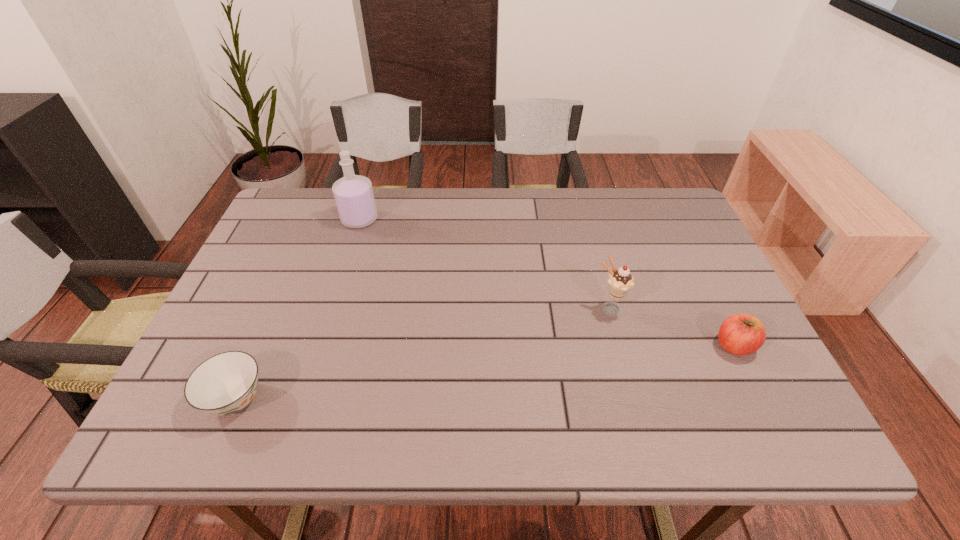
The height and width of the screenshot is (540, 960). I want to click on vacant area that lies between the perfume and the rightmost object, so (x=547, y=282).

The width and height of the screenshot is (960, 540). What are the coordinates of `vacant point located between the tallest object and the icecream` in the screenshot? It's located at (485, 265).

Identify the location of vacant point located between the second object from left to right and the shortest object. Image resolution: width=960 pixels, height=540 pixels. (298, 309).

The image size is (960, 540). In order to click on the closest object relative to the nearest object in this screenshot , I will do `click(353, 194)`.

Find the location of a particular element. This screenshot has width=960, height=540. object that is the third nearest to the third object from left to right is located at coordinates (224, 384).

In order to click on vacant region that satisfies the following two spatial constraints: 1. on the back side of the shortest object; 2. on the right side of the tallest object in this screenshot , I will do `click(314, 219)`.

The height and width of the screenshot is (540, 960). In order to click on blank space that satisfies the following two spatial constraints: 1. on the back side of the third farthest object; 2. on the right side of the shortest object in this screenshot , I will do `click(259, 346)`.

What are the coordinates of `vacant position in the image that satisfies the following two spatial constraints: 1. on the back side of the leftmost object; 2. on the right side of the third tallest object` in the screenshot? It's located at 259,346.

Identify the location of vacant space that satisfies the following two spatial constraints: 1. on the back side of the soup bowl; 2. on the right side of the farthest object. The image size is (960, 540). (314, 219).

Find the location of a particular element. vacant region that satisfies the following two spatial constraints: 1. on the back side of the shortest object; 2. on the left side of the icecream is located at coordinates (275, 310).